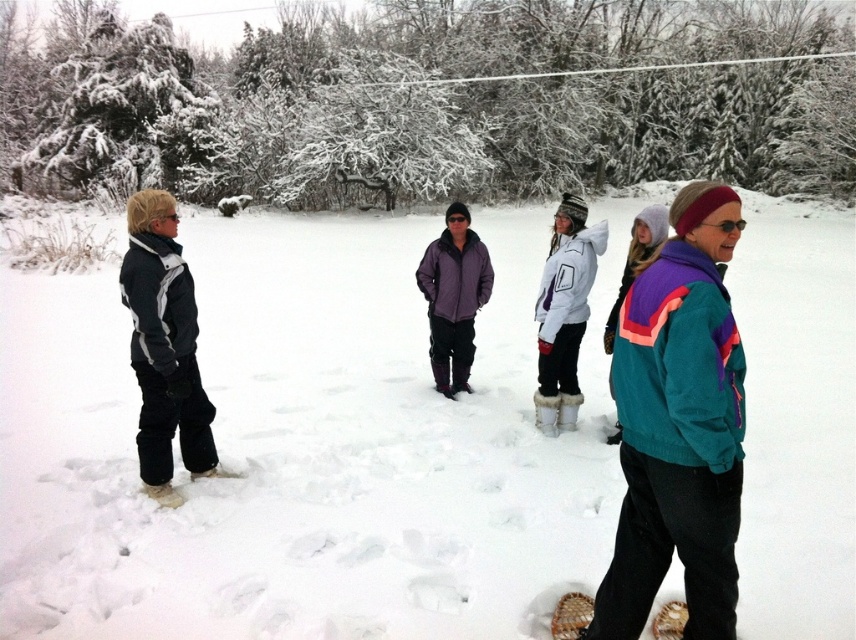
Question: Based on their relative distances, which object is farther from the purple quilted jacket at center?

Choices:
 (A) white woven snowshoe at lower left
 (B) white fleece jacket at center
 (C) white fur snowshoe at center

Answer: (A)

Question: Where is purple quilted jacket at center located in relation to white fur snowshoe at center in the image?

Choices:
 (A) above
 (B) below

Answer: (A)

Question: Which object is farther from the camera taking this photo?

Choices:
 (A) dark gray fleece jacket at left
 (B) white woven snowshoe at lower left

Answer: (B)

Question: Is dark gray fleece jacket at left closer to camera compared to purple quilted jacket at center?

Choices:
 (A) yes
 (B) no

Answer: (A)

Question: Among these objects, which one is nearest to the camera?

Choices:
 (A) purple quilted jacket at center
 (B) white woven snowshoe at lower left
 (C) dark gray fleece jacket at left

Answer: (C)

Question: Does dark gray fleece jacket at left have a lesser width compared to white fur snowshoe at lower center?

Choices:
 (A) yes
 (B) no

Answer: (B)